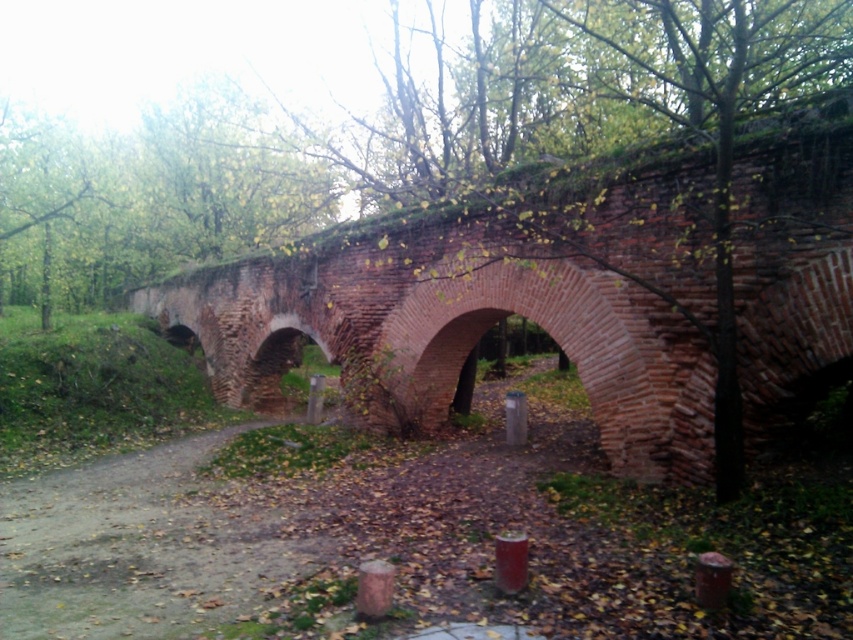
Question: Which of the following is the closest to the observer?

Choices:
 (A) (71, 496)
 (B) (573, 240)

Answer: (B)

Question: Can you confirm if red brick bridge at center is positioned to the right of dirt path at center?

Choices:
 (A) no
 (B) yes

Answer: (B)

Question: Can you confirm if red brick bridge at center is positioned to the left of dirt path at center?

Choices:
 (A) yes
 (B) no

Answer: (B)

Question: Among these points, which one is farthest from the camera?

Choices:
 (A) (225, 296)
 (B) (152, 476)

Answer: (A)

Question: Is red brick bridge at center positioned behind dirt path at center?

Choices:
 (A) yes
 (B) no

Answer: (B)

Question: Among these objects, which one is nearest to the camera?

Choices:
 (A) dirt path at center
 (B) red brick bridge at center

Answer: (B)